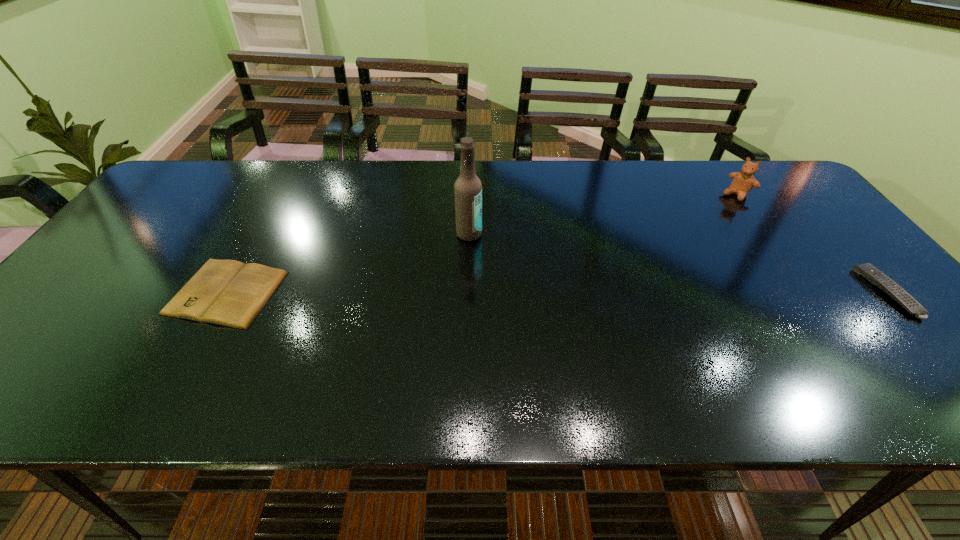
Find the location of a particular element. Image resolution: width=960 pixels, height=540 pixels. unoccupied position between the leftmost object and the second object from right to left is located at coordinates (482, 244).

This screenshot has height=540, width=960. I want to click on empty space between the rightmost object and the leftmost object, so click(x=557, y=293).

This screenshot has height=540, width=960. Identify the location of blank region between the remote control and the third object from left to right. (812, 243).

Identify the location of object identified as the second closest to the second object from right to left. The height and width of the screenshot is (540, 960). (468, 188).

Find the location of a particular element. The width and height of the screenshot is (960, 540). object identified as the second closest to the leftmost object is located at coordinates (743, 182).

Find the location of a particular element. The width and height of the screenshot is (960, 540). free spot that satisfies the following two spatial constraints: 1. on the back side of the book; 2. on the right side of the third nearest object is located at coordinates (259, 234).

Where is `free location that satisfies the following two spatial constraints: 1. on the back side of the leftmost object; 2. on the left side of the rightmost object`? This screenshot has height=540, width=960. free location that satisfies the following two spatial constraints: 1. on the back side of the leftmost object; 2. on the left side of the rightmost object is located at coordinates (227, 292).